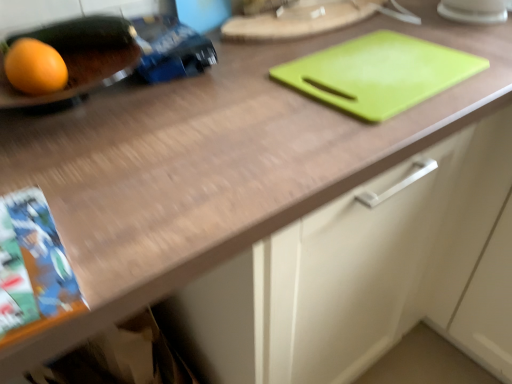
Question: Which direction should I rotate to face green plastic cutting board at upper center, the second tray from the left, — up or down?

Choices:
 (A) down
 (B) up

Answer: (B)

Question: Does orange matte grapefruit at left come behind matte black tray at left, the 3th tray when ordered from right to left?

Choices:
 (A) no
 (B) yes

Answer: (A)

Question: From a real-world perspective, is orange matte grapefruit at left beneath matte black tray at left, arranged as the first tray when viewed from the left?

Choices:
 (A) no
 (B) yes

Answer: (B)

Question: Does orange matte grapefruit at left have a smaller size compared to matte black tray at left, arranged as the first tray when viewed from the left?

Choices:
 (A) no
 (B) yes

Answer: (B)

Question: Considering the relative sizes of orange matte grapefruit at left and matte black tray at left, arranged as the first tray when viewed from the left, in the image provided, is orange matte grapefruit at left shorter than matte black tray at left, arranged as the first tray when viewed from the left,?

Choices:
 (A) no
 (B) yes

Answer: (A)

Question: Is matte black tray at left, arranged as the first tray when viewed from the left, located within orange matte grapefruit at left?

Choices:
 (A) no
 (B) yes

Answer: (A)

Question: From a real-world perspective, is orange matte grapefruit at left positioned over matte black tray at left, the 3th tray when ordered from right to left, based on gravity?

Choices:
 (A) yes
 (B) no

Answer: (B)

Question: Does orange matte grapefruit at left have a lesser width compared to green plastic cutting board at upper center, the second tray from the left?

Choices:
 (A) yes
 (B) no

Answer: (A)

Question: From a real-world perspective, is orange matte grapefruit at left on top of green plastic cutting board at upper center, the second tray from the left?

Choices:
 (A) no
 (B) yes

Answer: (B)

Question: Would you say orange matte grapefruit at left contains green plastic cutting board at upper center, the second tray from the left?

Choices:
 (A) no
 (B) yes

Answer: (A)

Question: From the image's perspective, is orange matte grapefruit at left above green plastic cutting board at upper center, which appears as the 2th tray when viewed from the right?

Choices:
 (A) no
 (B) yes

Answer: (A)

Question: Is the position of orange matte grapefruit at left more distant than that of green plastic cutting board at upper center, the second tray from the left?

Choices:
 (A) yes
 (B) no

Answer: (B)

Question: Is orange matte grapefruit at left positioned before green plastic cutting board at upper center, which appears as the 2th tray when viewed from the right?

Choices:
 (A) yes
 (B) no

Answer: (A)

Question: Does green plastic cutting board at upper right, the 3th tray in the left-to-right sequence, have a lesser width compared to matte black tray at left, arranged as the first tray when viewed from the left?

Choices:
 (A) yes
 (B) no

Answer: (B)